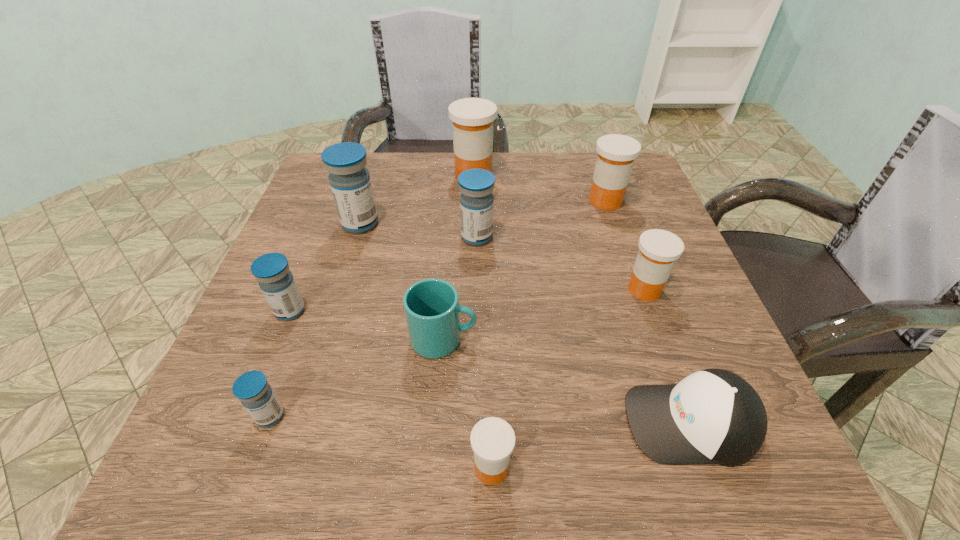
The width and height of the screenshot is (960, 540). Find the location of `the biggest orange medicine`. the biggest orange medicine is located at coordinates click(x=472, y=118).

Locate an element on the screen. the farthest object is located at coordinates (472, 118).

Locate an element on the screen. the biggest blue medicine is located at coordinates (349, 179).

The image size is (960, 540). I want to click on the second farthest orange medicine, so click(x=616, y=153).

Identify the location of the rightmost blue medicine. (476, 186).

Identify the location of the third biggest orange medicine. This screenshot has height=540, width=960. (658, 249).

Find the location of a particular element. The image size is (960, 540). the second nearest blue medicine is located at coordinates (271, 270).

Where is `cup`? cup is located at coordinates (431, 306).

Identify the location of gray cap. (713, 416).

In order to click on the smallest blue medicine in this screenshot , I will do `click(252, 389)`.